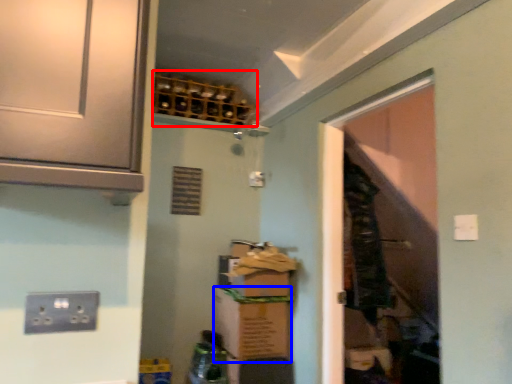
Question: Which point is further to the camera, wine rack (highlighted by a red box) or cardboard box (highlighted by a blue box)?

Choices:
 (A) wine rack
 (B) cardboard box

Answer: (A)